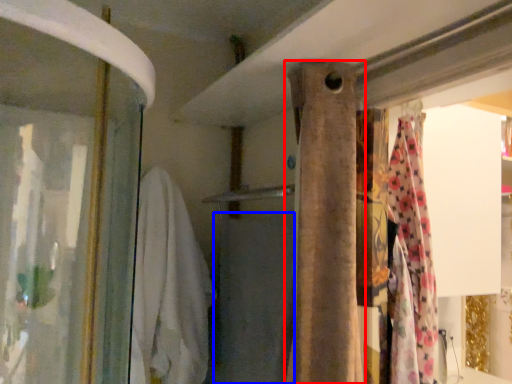
Question: Which of the following is the farthest to the observer, curtain (highlighted by a red box) or bath towel (highlighted by a blue box)?

Choices:
 (A) curtain
 (B) bath towel

Answer: (B)